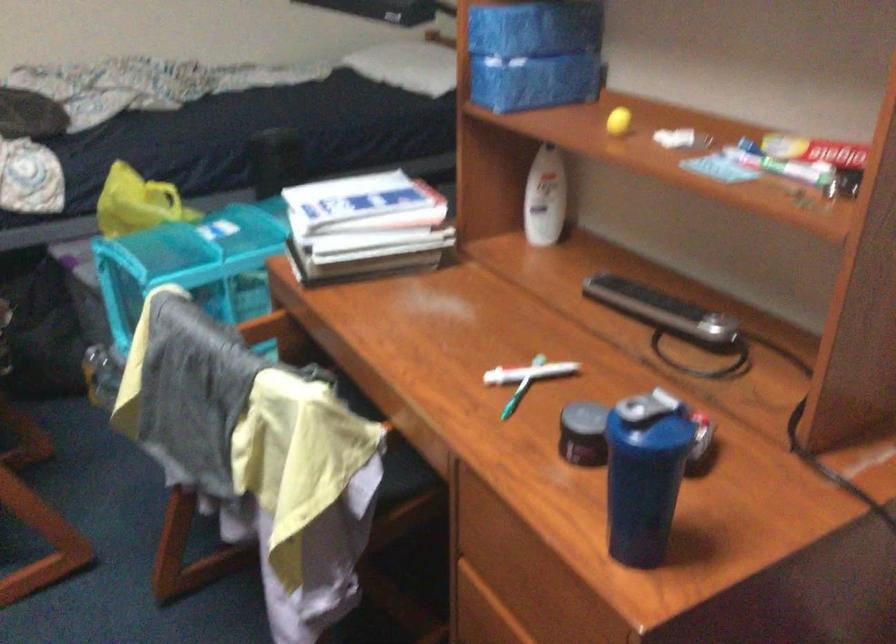
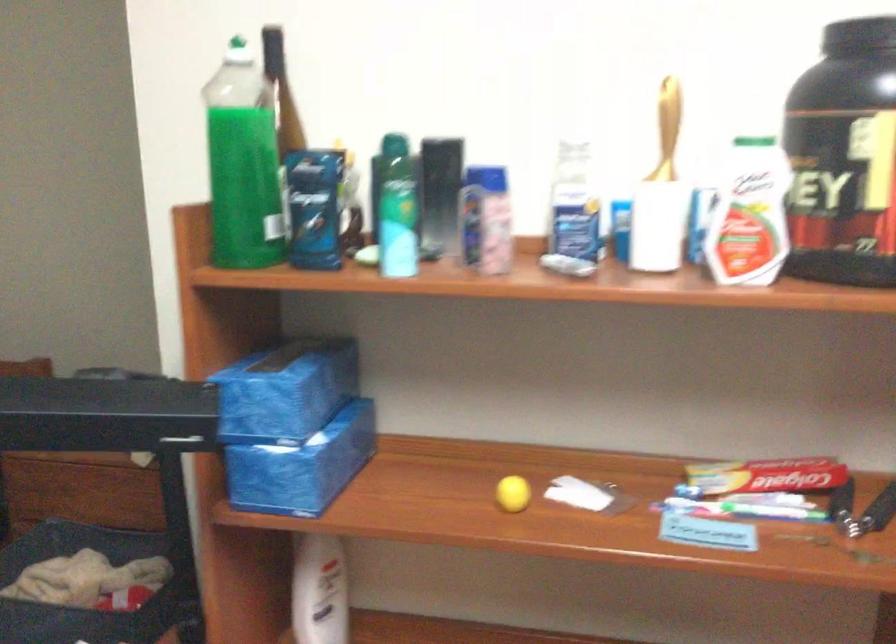
Where in the second image is the point corresponding to the point at 538,191 from the first image?

(319, 591)